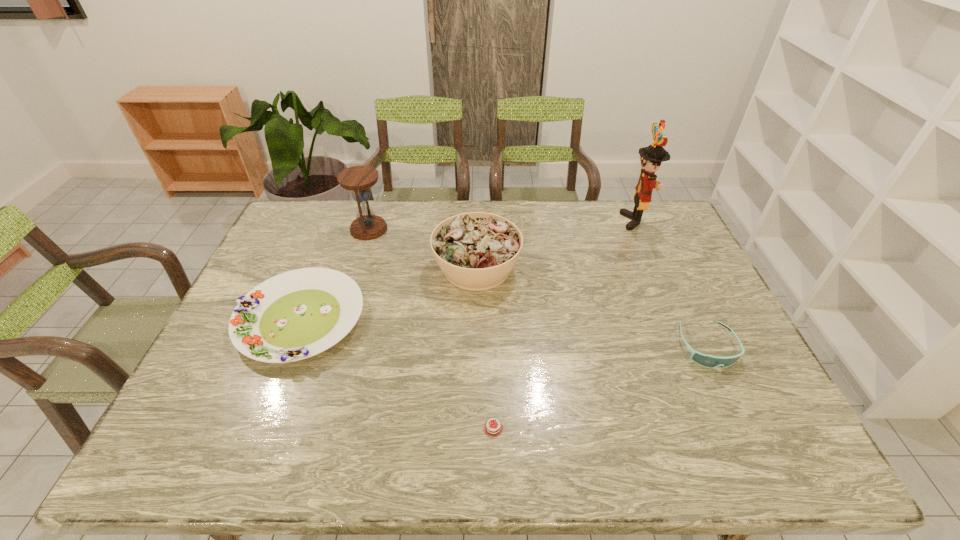
In order to click on vacant space situated on the back of the hourglass in this screenshot , I will do click(x=375, y=206).

Where is `vacant space located 0.140m on the front of the third tallest object`? vacant space located 0.140m on the front of the third tallest object is located at coordinates (476, 336).

I want to click on free space located on the back of the salad plate, so click(344, 210).

Where is `vacant space positioned 0.080m on the front-facing side of the goggles`? vacant space positioned 0.080m on the front-facing side of the goggles is located at coordinates (732, 399).

This screenshot has width=960, height=540. Identify the location of vacant space located on the right of the nearest object. (686, 428).

This screenshot has height=540, width=960. Find the location of `nutcracker that is positioned at the far edge`. nutcracker that is positioned at the far edge is located at coordinates (651, 157).

This screenshot has height=540, width=960. What are the coordinates of `hourglass located at the far edge` in the screenshot? It's located at (367, 226).

The width and height of the screenshot is (960, 540). What are the coordinates of `object located at the near edge` in the screenshot? It's located at (492, 428).

Where is `object that is at the left edge`? This screenshot has width=960, height=540. object that is at the left edge is located at coordinates (295, 315).

This screenshot has height=540, width=960. Identify the location of nutcracker that is positioned at the right edge. (651, 157).